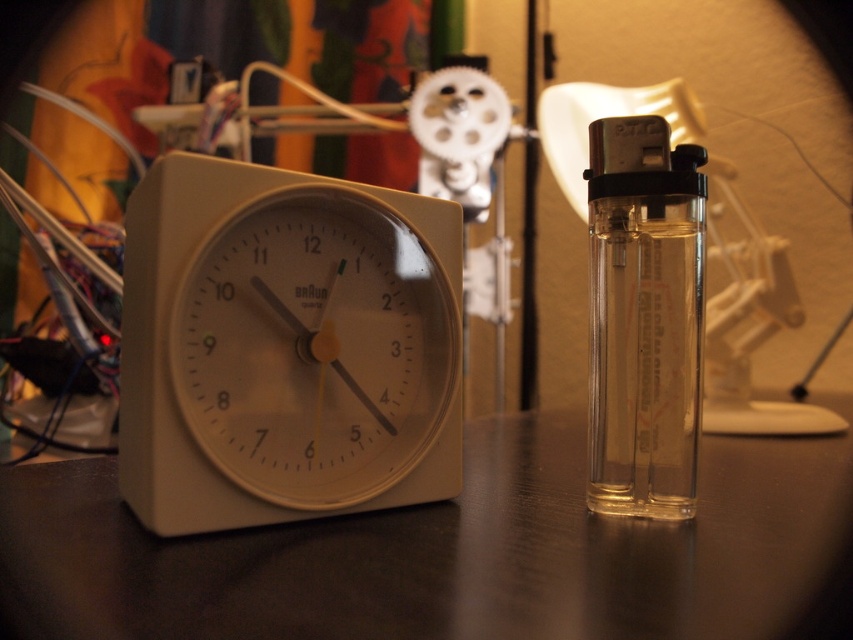
You have a small box that needs to fit either the white plastic clock at left or the transparent plastic lighter at right. If the box can only accommodate the narrower object, which one should you choose?

The transparent plastic lighter at right is narrower than the white plastic clock at left, so you should choose the transparent plastic lighter at right to fit into the box.

Consider the image. You are organizing items on the desk and need to place a new object between the black matte table at center and the white plastic clock at left. Based on their positions, which object is closer to you so you can start arranging from there?

The black matte table at center is closer to the viewer than the white plastic clock at left, so you should start arranging from the black matte table at center first.